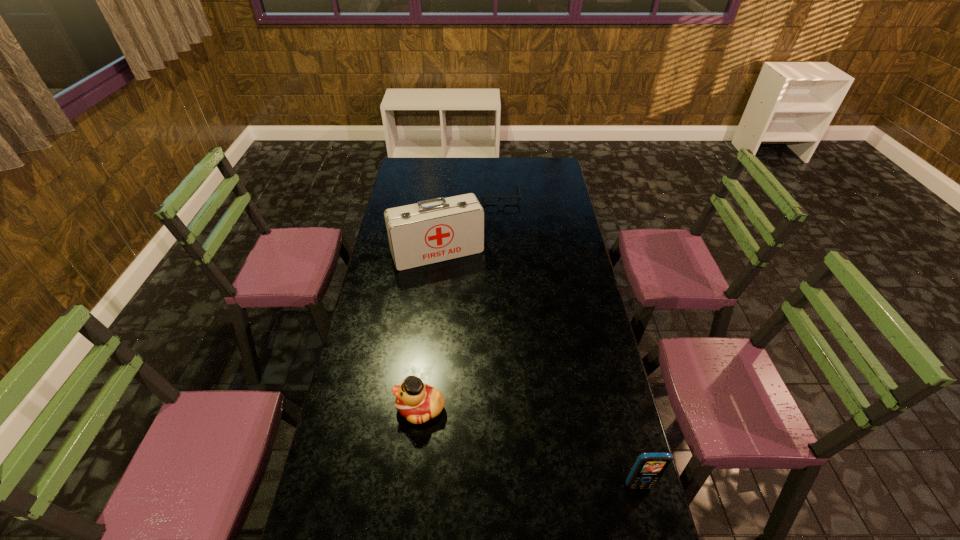
Locate an element on the screen. The height and width of the screenshot is (540, 960). vacant area at the far edge is located at coordinates (492, 161).

Where is `free space at the left edge of the desktop`? This screenshot has width=960, height=540. free space at the left edge of the desktop is located at coordinates (361, 368).

Identify the location of free space at the right edge of the desktop. The height and width of the screenshot is (540, 960). (613, 394).

Locate an element on the screen. Image resolution: width=960 pixels, height=540 pixels. vacant space at the near right corner of the desktop is located at coordinates (634, 512).

This screenshot has height=540, width=960. Identify the location of empty space between the third nearest object and the cellular telephone. (539, 369).

The width and height of the screenshot is (960, 540). Find the location of `vacant area between the spectacles and the third shortest object`. vacant area between the spectacles and the third shortest object is located at coordinates (570, 340).

Image resolution: width=960 pixels, height=540 pixels. Identify the location of vacant area between the nearest object and the first-aid kit. (539, 369).

This screenshot has width=960, height=540. Identify the location of vacant area between the nearest object and the shortest object. (570, 340).

At what (x,y) coordinates should I click in order to perform the action: click on empty space that is in between the third tallest object and the cellular telephone. Please return your answer as a coordinate pair (x, y). This screenshot has width=960, height=540. Looking at the image, I should click on (530, 447).

I want to click on unoccupied position between the second farthest object and the rightmost object, so click(x=539, y=369).